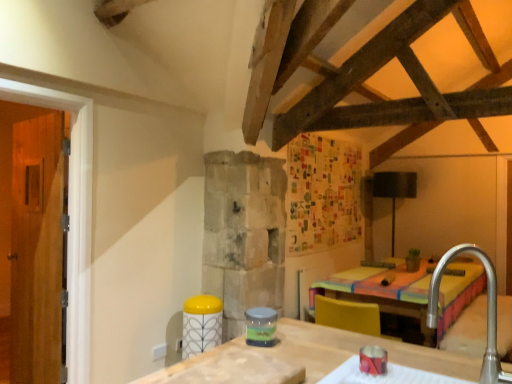
This screenshot has width=512, height=384. Describe the element at coordinates (394, 191) in the screenshot. I see `black matte lamp at upper right` at that location.

Where is `black matte lamp at upper right`? black matte lamp at upper right is located at coordinates (394, 191).

What is the approximate width of black matte lamp at upper right?

The width of black matte lamp at upper right is 20.15 inches.

The height and width of the screenshot is (384, 512). I want to click on black matte lamp at upper right, so click(x=394, y=191).